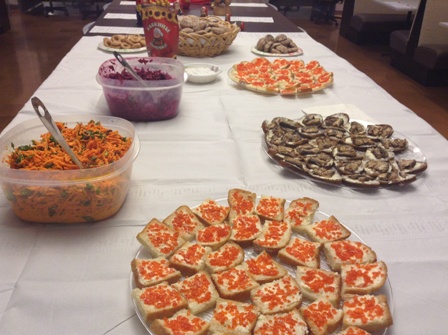
You are a GUI agent. You are given a task and a screenshot of the screen. Output one action in this format:
    pyautogui.click(x=<x>, y=<y>)
    Task: Click on the table
    This screenshot has width=448, height=335.
    Given the screenshot: What is the action you would take?
    pyautogui.click(x=215, y=143)